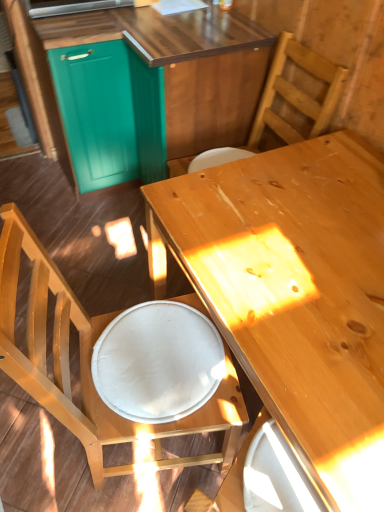
Question: Considering the relative sizes of teal wood cabinetry at upper left and light brown wood desk at center in the image provided, is teal wood cabinetry at upper left taller than light brown wood desk at center?

Choices:
 (A) yes
 (B) no

Answer: (A)

Question: Can you confirm if teal wood cabinetry at upper left is positioned to the left of light brown wood desk at center?

Choices:
 (A) yes
 (B) no

Answer: (A)

Question: From the image's perspective, is teal wood cabinetry at upper left below light brown wood desk at center?

Choices:
 (A) no
 (B) yes

Answer: (A)

Question: Are teal wood cabinetry at upper left and light brown wood desk at center far apart?

Choices:
 (A) no
 (B) yes

Answer: (A)

Question: Considering the relative sizes of teal wood cabinetry at upper left and light brown wood desk at center in the image provided, is teal wood cabinetry at upper left thinner than light brown wood desk at center?

Choices:
 (A) no
 (B) yes

Answer: (A)

Question: Is teal wood cabinetry at upper left to the right of light brown wood desk at center from the viewer's perspective?

Choices:
 (A) no
 (B) yes

Answer: (A)

Question: Could you tell me if wooden chair at lower left, which appears as the first chair when ordered from the bottom, is facing teal wood cabinetry at upper left?

Choices:
 (A) yes
 (B) no

Answer: (B)

Question: Is wooden chair at lower left, which appears as the first chair when ordered from the bottom, smaller than teal wood cabinetry at upper left?

Choices:
 (A) no
 (B) yes

Answer: (B)

Question: Considering the relative sizes of wooden chair at lower left, which appears as the first chair when ordered from the bottom, and teal wood cabinetry at upper left in the image provided, is wooden chair at lower left, which appears as the first chair when ordered from the bottom, bigger than teal wood cabinetry at upper left?

Choices:
 (A) yes
 (B) no

Answer: (B)

Question: From a real-world perspective, is wooden chair at lower left, which appears as the 2th chair when viewed from the top, below teal wood cabinetry at upper left?

Choices:
 (A) yes
 (B) no

Answer: (B)

Question: Are wooden chair at lower left, which appears as the 2th chair when viewed from the top, and teal wood cabinetry at upper left beside each other?

Choices:
 (A) no
 (B) yes

Answer: (A)

Question: From the image's perspective, is wooden chair at lower left, which appears as the first chair when ordered from the bottom, located beneath teal wood cabinetry at upper left?

Choices:
 (A) yes
 (B) no

Answer: (A)

Question: Does light brown wood desk at center turn towards teal wood cabinetry at upper left?

Choices:
 (A) no
 (B) yes

Answer: (A)